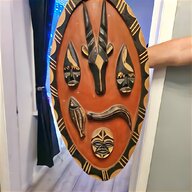
The width and height of the screenshot is (192, 192). Find the location of `window`. window is located at coordinates (57, 5).